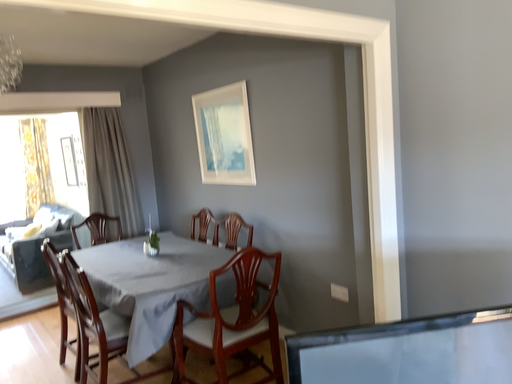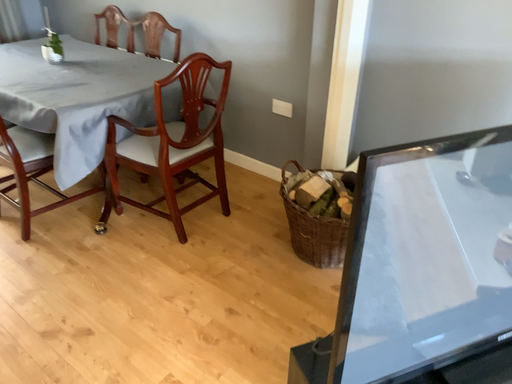
Question: Which way did the camera rotate in the video?

Choices:
 (A) rotated left
 (B) rotated right

Answer: (B)